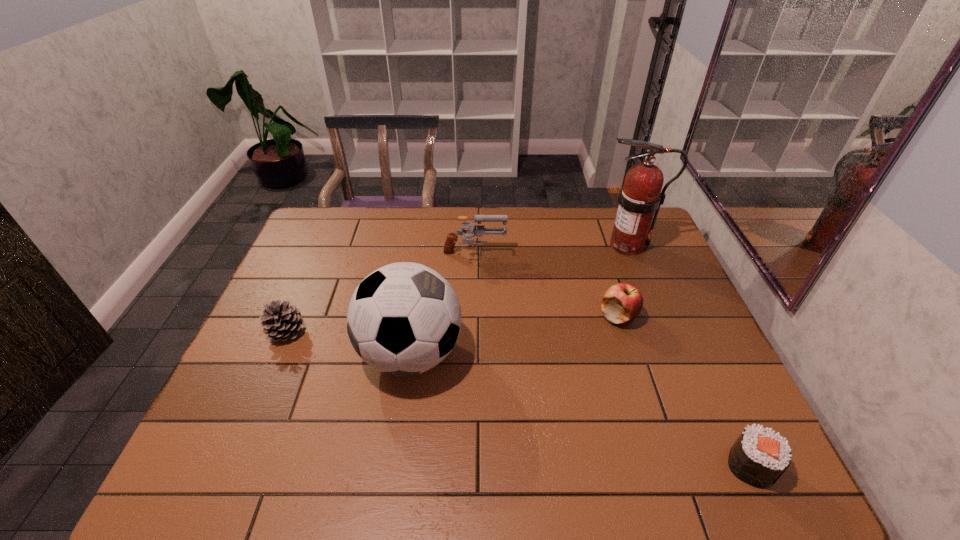
Locate an element on the screen. The image size is (960, 540). fire extinguisher is located at coordinates (640, 197).

At what (x,y) coordinates should I click in order to perform the action: click on the second tallest object. Please return your answer as a coordinate pair (x, y). Looking at the image, I should click on (403, 319).

You are a GUI agent. You are given a task and a screenshot of the screen. Output one action in this format:
    pyautogui.click(x=<x>, y=<y>)
    Task: Click on the fourth shortest object
    This screenshot has height=540, width=960.
    Given the screenshot: What is the action you would take?
    pyautogui.click(x=479, y=230)

The height and width of the screenshot is (540, 960). In order to click on apple in this screenshot , I will do click(x=622, y=303).

Identify the location of pinecone. point(281,322).

Find the location of a particular element. The height and width of the screenshot is (540, 960). sushi is located at coordinates (759, 457).

Find the location of a particular element. The image size is (960, 540). the nearest object is located at coordinates (759, 457).

Locate an element on the screen. vacant space located 0.070m at the nozzle of the tallest object is located at coordinates tap(574, 246).

What are the coordinates of `free region located at the nozzle of the tallest object` in the screenshot? It's located at (565, 246).

I want to click on vacant space situated 0.300m at the nozzle of the tallest object, so click(x=506, y=246).